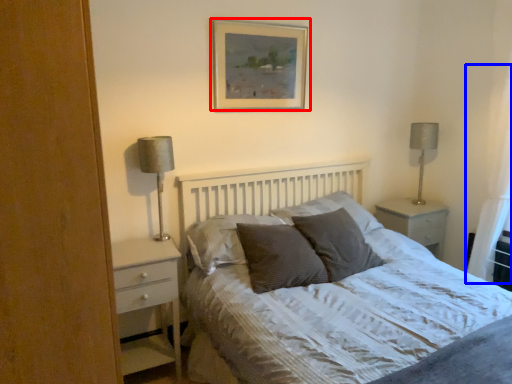
Question: Which object is further to the camera taking this photo, picture frame (highlighted by a red box) or curtain (highlighted by a blue box)?

Choices:
 (A) picture frame
 (B) curtain

Answer: (A)